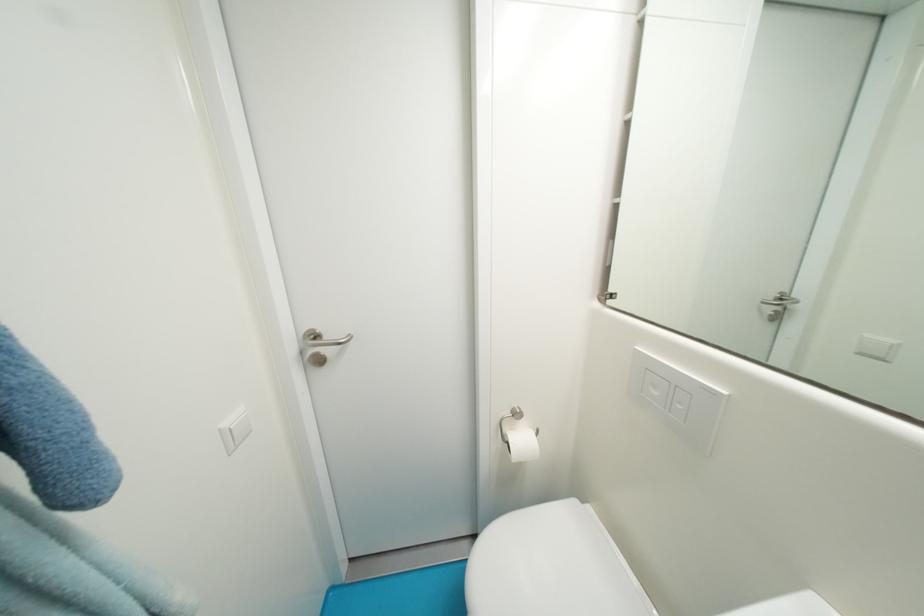
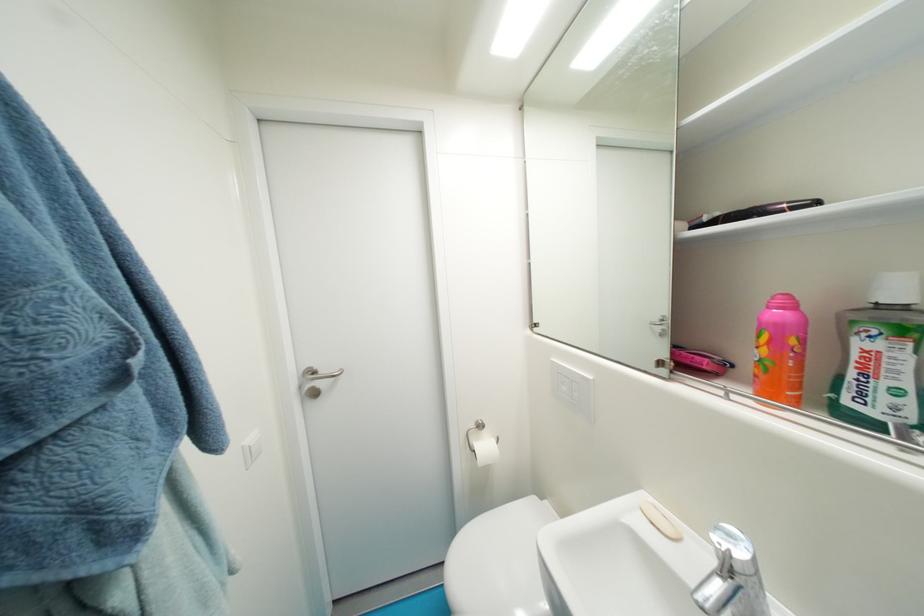
The point at (323, 339) is marked in the first image. Where is the corresponding point in the second image?

(322, 374)